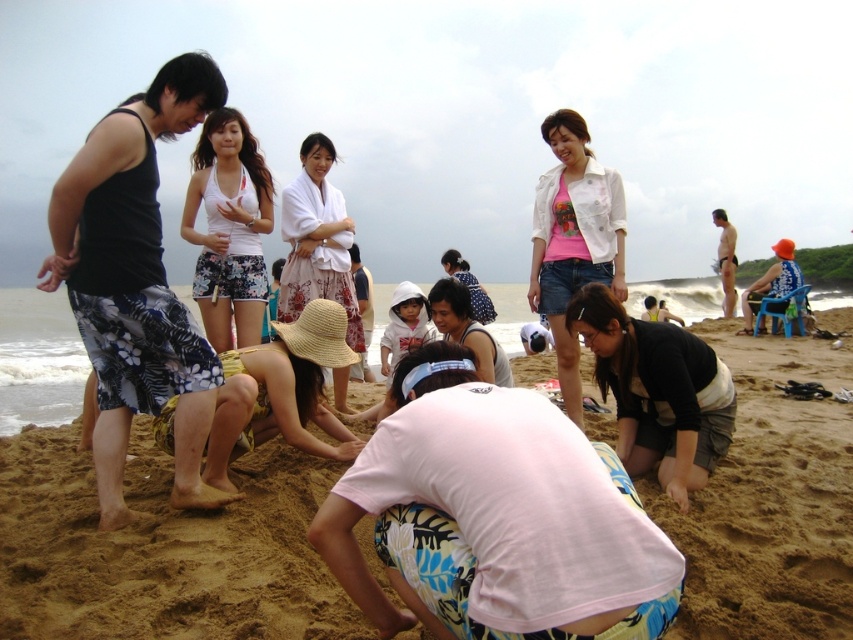
In the beach scene, there are two people wearing black cotton shirt at lower center and white cotton hoodie at center. Which one is wider?

The black cotton shirt at lower center is wider than the white cotton hoodie at center.